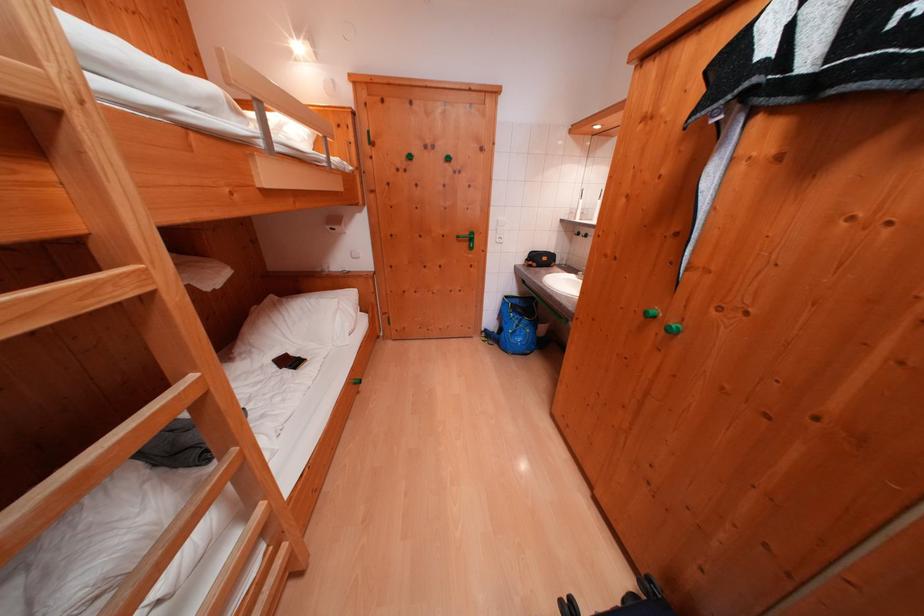
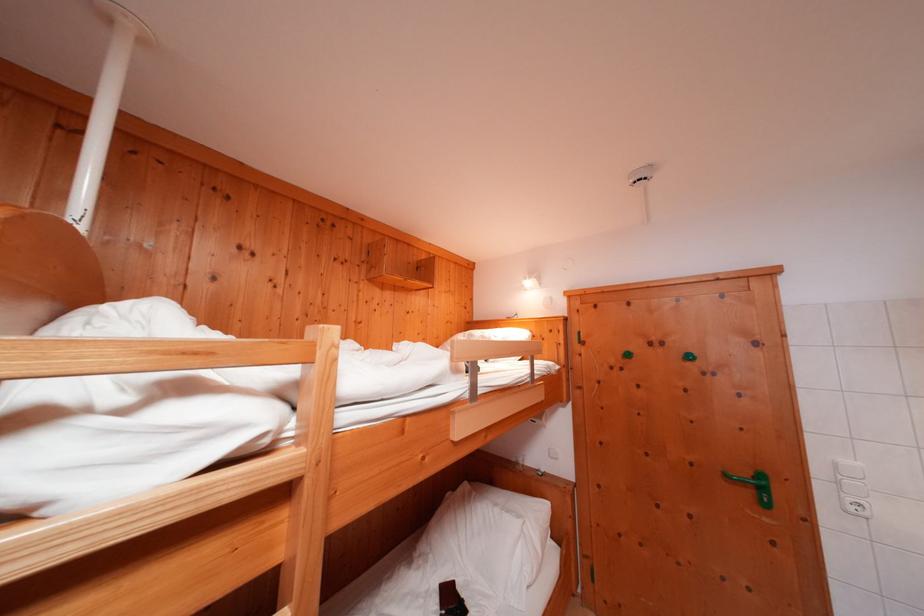
In the second image, find the point that corresponds to point (295, 359) in the first image.

(463, 586)